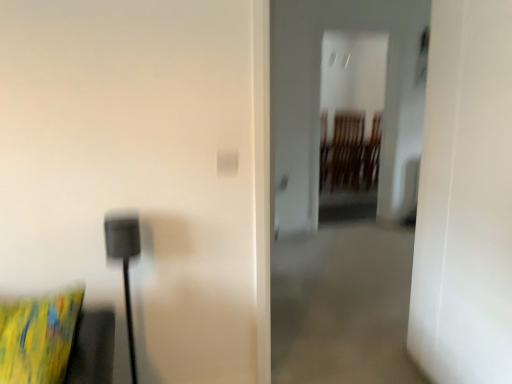
What is the approximate width of transparent glass door at center?

The width of transparent glass door at center is 13.71 inches.

Describe the element at coordinates (352, 121) in the screenshot. I see `transparent glass door at center` at that location.

This screenshot has width=512, height=384. What are the coordinates of `transparent glass door at center` in the screenshot? It's located at (352, 121).

Describe the element at coordinates (38, 336) in the screenshot. I see `yellow fabric pillow at lower left` at that location.

In order to click on yellow fabric pillow at lower left in this screenshot , I will do `click(38, 336)`.

Where is `transparent glass door at center`? The height and width of the screenshot is (384, 512). transparent glass door at center is located at coordinates pos(352,121).

Which object is positioned more to the right, transparent glass door at center or yellow fabric pillow at lower left?

transparent glass door at center.

Between transparent glass door at center and yellow fabric pillow at lower left, which one is positioned in front?

yellow fabric pillow at lower left is closer to the camera.

Which is farther, (x=355, y=78) or (x=42, y=366)?

Positioned behind is point (x=355, y=78).

From the image's perspective, is transparent glass door at center above or below yellow fabric pillow at lower left?

Clearly, from the image's perspective, transparent glass door at center is above yellow fabric pillow at lower left.

From a real-world perspective, is transparent glass door at center positioned under yellow fabric pillow at lower left based on gravity?

No, from a real-world perspective, transparent glass door at center is not below yellow fabric pillow at lower left.

In the scene shown: Is transparent glass door at center thinner than yellow fabric pillow at lower left?

Indeed, transparent glass door at center has a lesser width compared to yellow fabric pillow at lower left.

Considering the sizes of objects transparent glass door at center and yellow fabric pillow at lower left in the image provided, who is shorter, transparent glass door at center or yellow fabric pillow at lower left?

With less height is yellow fabric pillow at lower left.

Which of these two, transparent glass door at center or yellow fabric pillow at lower left, is smaller?

yellow fabric pillow at lower left is smaller.

Is transparent glass door at center completely or partially outside of yellow fabric pillow at lower left?

Yes, transparent glass door at center is located beyond the bounds of yellow fabric pillow at lower left.

Is transparent glass door at center with yellow fabric pillow at lower left?

There is a gap between transparent glass door at center and yellow fabric pillow at lower left.

Is transparent glass door at center facing towards yellow fabric pillow at lower left?

No.

What's the angular difference between transparent glass door at center and yellow fabric pillow at lower left's facing directions?

15.2 degrees.

How distant is transparent glass door at center from yellow fabric pillow at lower left?

The distance of transparent glass door at center from yellow fabric pillow at lower left is 15.26 feet.

Image resolution: width=512 pixels, height=384 pixels. I want to click on pillow lying on the left of transparent glass door at center, so click(x=38, y=336).

Which is more to the right, yellow fabric pillow at lower left or transparent glass door at center?

Positioned to the right is transparent glass door at center.

Consider the image. Which is in front, yellow fabric pillow at lower left or transparent glass door at center?

yellow fabric pillow at lower left.

Is point (0, 366) closer or farther from the camera than point (324, 192)?

Point (0, 366) is closer to the camera than point (324, 192).

From the image's perspective, which is above, yellow fabric pillow at lower left or transparent glass door at center?

transparent glass door at center, from the image's perspective.

From a real-world perspective, is yellow fabric pillow at lower left physically located above or below transparent glass door at center?

In terms of real-world spatial position, yellow fabric pillow at lower left is below transparent glass door at center.

Does yellow fabric pillow at lower left have a greater width compared to transparent glass door at center?

Indeed, yellow fabric pillow at lower left has a greater width compared to transparent glass door at center.

Can you confirm if yellow fabric pillow at lower left is shorter than transparent glass door at center?

Yes.

Between yellow fabric pillow at lower left and transparent glass door at center, which one has smaller size?

yellow fabric pillow at lower left.

Do you think yellow fabric pillow at lower left is within transparent glass door at center, or outside of it?

yellow fabric pillow at lower left is not inside transparent glass door at center, it's outside.

Are yellow fabric pillow at lower left and transparent glass door at center far apart?

Yes, yellow fabric pillow at lower left is far from transparent glass door at center.

Is transparent glass door at center at the back of yellow fabric pillow at lower left?

No, yellow fabric pillow at lower left is not facing the opposite direction of transparent glass door at center.

Based on the photo, how many degrees apart are the facing directions of yellow fabric pillow at lower left and transparent glass door at center?

15.2 degrees separate the facing orientations of yellow fabric pillow at lower left and transparent glass door at center.

Measure the distance between yellow fabric pillow at lower left and transparent glass door at center.

yellow fabric pillow at lower left is 15.26 feet from transparent glass door at center.

The width and height of the screenshot is (512, 384). I want to click on pillow that appears on the left of transparent glass door at center, so click(38, 336).

The image size is (512, 384). What are the coordinates of `glass door above the yellow fabric pillow at lower left (from the image's perspective)` in the screenshot? It's located at (352, 121).

You are a GUI agent. You are given a task and a screenshot of the screen. Output one action in this format:
    pyautogui.click(x=<x>, y=<y>)
    Task: Click on the pillow in front of the transparent glass door at center
    The height and width of the screenshot is (384, 512).
    Given the screenshot: What is the action you would take?
    pyautogui.click(x=38, y=336)